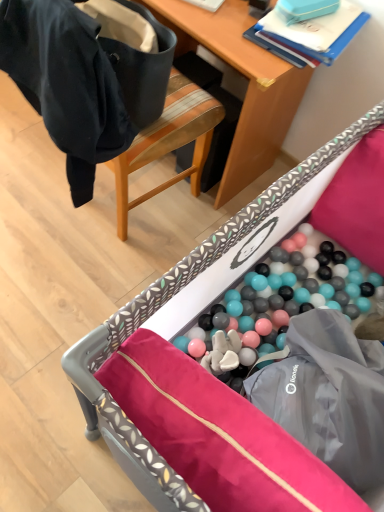
Question: From a real-world perspective, is wooden desk at upper center physically located above or below black fabric chair at upper left?

Choices:
 (A) below
 (B) above

Answer: (A)

Question: Is wooden desk at upper center in front of or behind black fabric chair at upper left in the image?

Choices:
 (A) behind
 (B) front

Answer: (A)

Question: Estimate the real-world distances between objects in this image. Which object is farther from the plastic ball pit at lower center?

Choices:
 (A) wooden desk at upper center
 (B) black fabric chair at upper left

Answer: (A)

Question: Which is farther from the wooden desk at upper center?

Choices:
 (A) plastic ball pit at lower center
 (B) black fabric chair at upper left

Answer: (A)